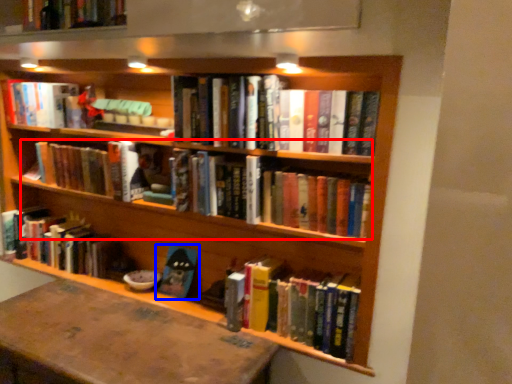
Question: Among these objects, which one is nearest to the camera, book (highlighted by a red box) or book (highlighted by a blue box)?

Choices:
 (A) book
 (B) book

Answer: (A)